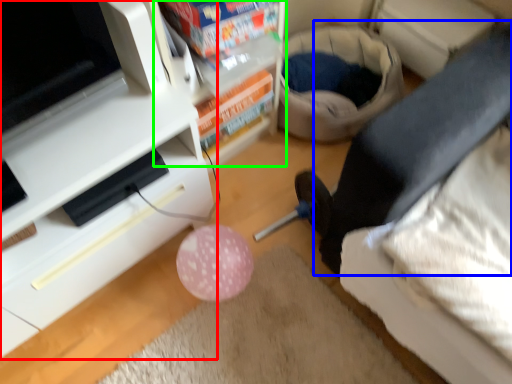
Question: Which object is the farthest from furniture (highlighted by a red box)? Choose among these: leg (highlighted by a blue box) or shelf (highlighted by a green box).

Choices:
 (A) leg
 (B) shelf

Answer: (A)